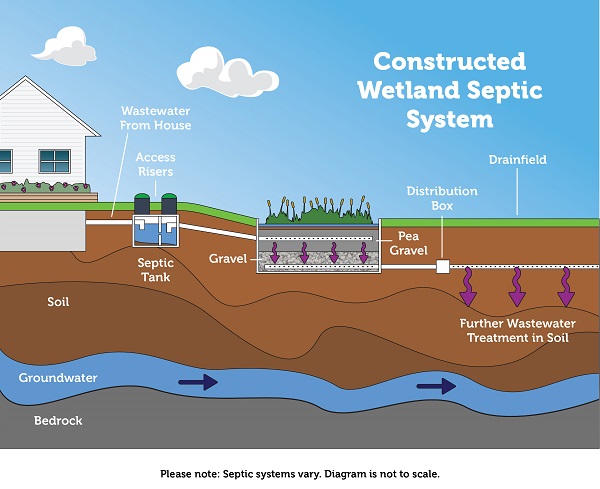
Where is `window`? Image resolution: width=600 pixels, height=489 pixels. window is located at coordinates click(51, 166), click(48, 158), click(62, 152), click(61, 165), click(5, 169), click(4, 155).